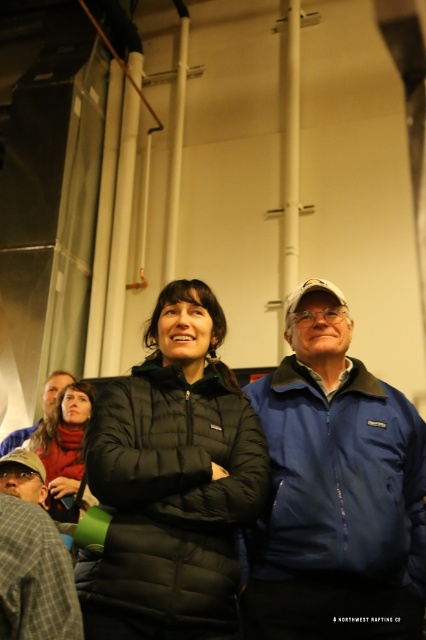
You are standing in the room and want to hand a gift to the person wearing the blue fleece jacket at center. Based on their position, where should you walk to in the room to reach them?

The blue fleece jacket at center is located at point 0.767 on the x axis and 0.789 on the y axis, so you should walk towards the center area of the room to reach them.

You are organizing a photo shoot and need to ensure that both the black puffer jacket at center and the plaid wool jacket at lower left are visible in the frame. Based on their positions, which jacket is closer to the camera?

The black puffer jacket at center is closer to the camera because the plaid wool jacket at lower left is positioned behind it.